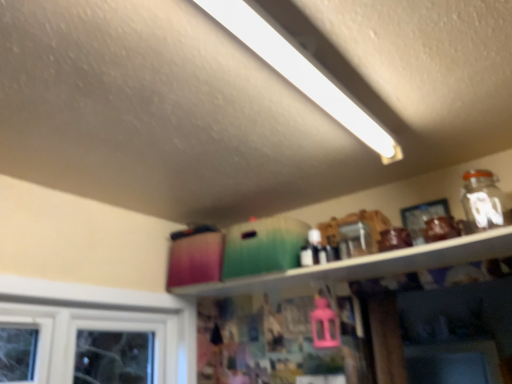
Identify the location of free space above white fluorescent tube at upper center (from a real-world perspective). (319, 63).